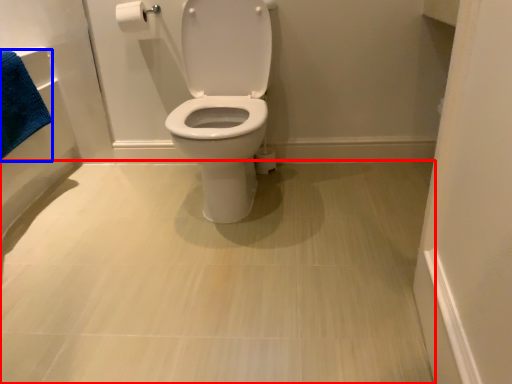
Question: Which object is closer to the camera taking this photo, plain (highlighted by a red box) or bath towel (highlighted by a blue box)?

Choices:
 (A) plain
 (B) bath towel

Answer: (A)